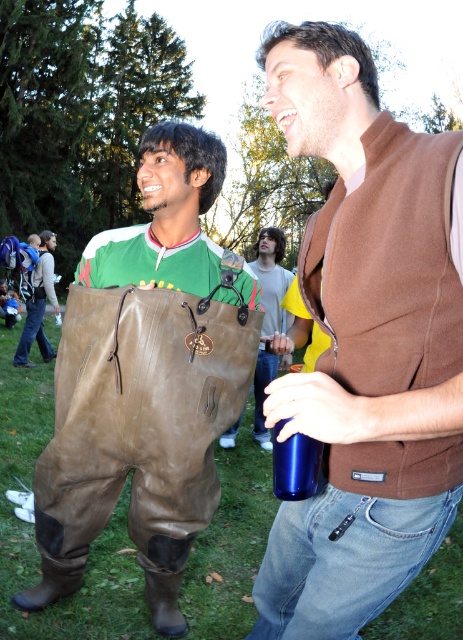
Is point (460, 408) closer to viewer compared to point (256, 406)?

That is True.

The width and height of the screenshot is (463, 640). In order to click on brown wool vest at upper right in this screenshot , I will do `click(364, 346)`.

Which is in front, point (256, 365) or point (50, 301)?

Point (256, 365)

This screenshot has height=640, width=463. In order to click on brown leather bag at center in this screenshot , I will do `click(270, 275)`.

Measure the distance between brown leather bag at center and camera.

brown leather bag at center is 13.99 feet away from camera.

Identify the location of brown leather bag at center. This screenshot has width=463, height=640. (270, 275).

Does brown wool vest at upper right come behind brown leather pants at lower left?

No.

Which is behind, point (375, 259) or point (42, 326)?

Positioned behind is point (42, 326).

Which is in front, point (456, 355) or point (26, 304)?

Point (456, 355)

Image resolution: width=463 pixels, height=640 pixels. In order to click on brown wool vest at upper right in this screenshot , I will do `click(364, 346)`.